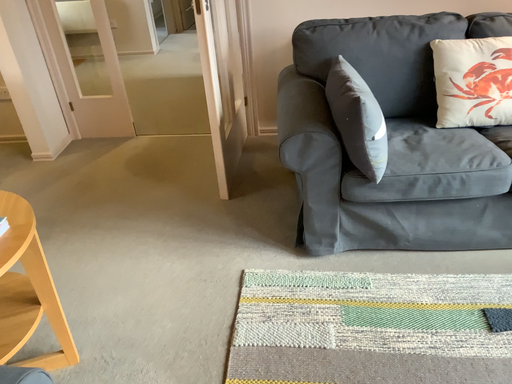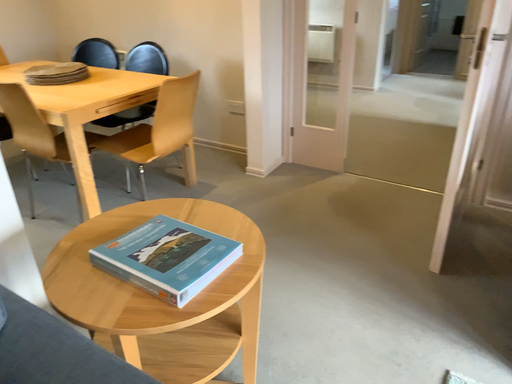
Question: How did the camera likely rotate when shooting the video?

Choices:
 (A) rotated upward
 (B) rotated downward

Answer: (A)